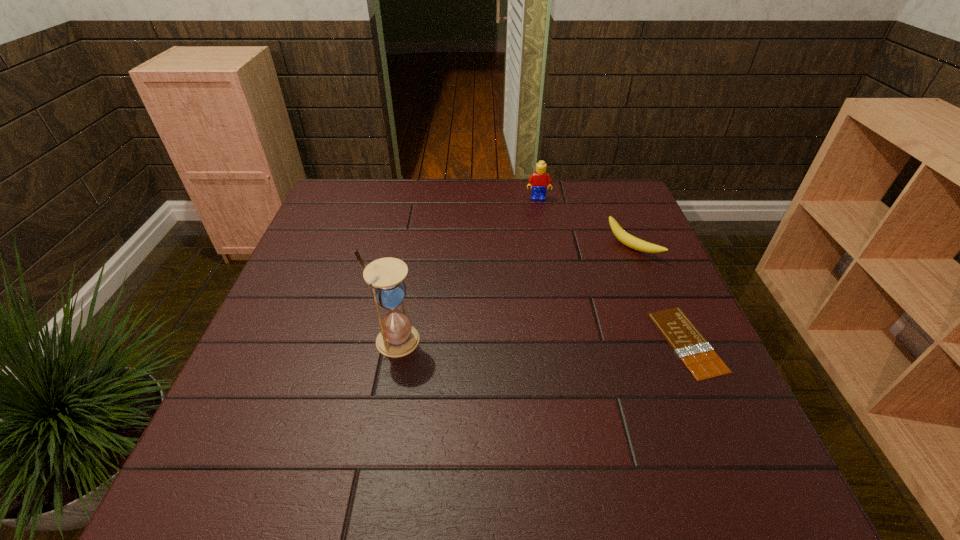
Find the location of a particular element. Image resolution: width=960 pixels, height=540 pixels. vacant region between the third nearest object and the second tallest object is located at coordinates (586, 223).

You are a GUI agent. You are given a task and a screenshot of the screen. Output one action in this format:
    pyautogui.click(x=<x>, y=<y>)
    Task: Click on the empty space that is in between the second farthest object and the shortest object
    
    Given the screenshot: What is the action you would take?
    pyautogui.click(x=660, y=295)

Image resolution: width=960 pixels, height=540 pixels. Identify the location of vacant area that lies between the second tallest object and the chocolate bar. (612, 270).

This screenshot has height=540, width=960. I want to click on vacant space that's between the chocolate bar and the banana, so click(660, 295).

Identify the location of vacant point located between the third shortest object and the hourglass. This screenshot has width=960, height=540. (467, 269).

Where is `object that is the second closest to the banana`? The height and width of the screenshot is (540, 960). object that is the second closest to the banana is located at coordinates (539, 180).

Locate an element on the screen. This screenshot has height=540, width=960. object that stands as the second closest to the shortest object is located at coordinates (539, 180).

Where is `vacant point that satisfies the following two spatial constraints: 1. on the back side of the hourglass; 2. on the left side of the farthest object`? vacant point that satisfies the following two spatial constraints: 1. on the back side of the hourglass; 2. on the left side of the farthest object is located at coordinates (421, 198).

Where is `free space that satisfies the following two spatial constraints: 1. on the front side of the hourglass; 2. on the right side of the shortest object`? free space that satisfies the following two spatial constraints: 1. on the front side of the hourglass; 2. on the right side of the shortest object is located at coordinates (395, 342).